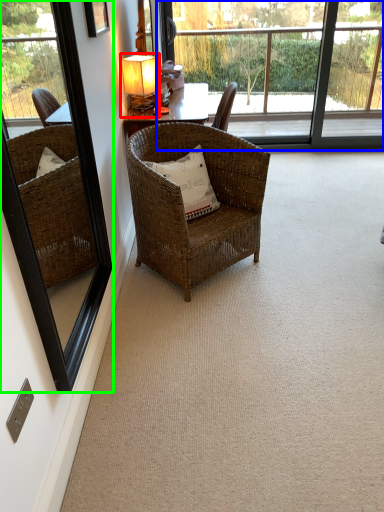
Question: Which object is positioned farthest from table lamp (highlighted by a red box)? Select from bay window (highlighted by a blue box) and window frame (highlighted by a green box).

Choices:
 (A) bay window
 (B) window frame

Answer: (A)